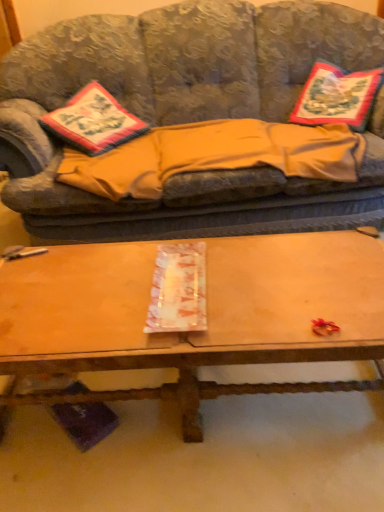
Question: Looking at the image, does wooden at center seem bigger or smaller compared to embroidered fabric pillow at upper right?

Choices:
 (A) small
 (B) big

Answer: (B)

Question: From their relative heights in the image, would you say wooden at center is taller or shorter than embroidered fabric pillow at upper right?

Choices:
 (A) tall
 (B) short

Answer: (B)

Question: Considering the real-world distances, which object is farthest from the embroidered fabric pillow at upper right?

Choices:
 (A) wooden at center
 (B) embroidered fabric pillow at left
 (C) textured fabric couch at center
 (D) beige fleece blanket at center

Answer: (A)

Question: Estimate the real-world distances between objects in this image. Which object is farther from the embroidered fabric pillow at left?

Choices:
 (A) embroidered fabric pillow at upper right
 (B) textured fabric couch at center
 (C) beige fleece blanket at center
 (D) wooden at center

Answer: (D)